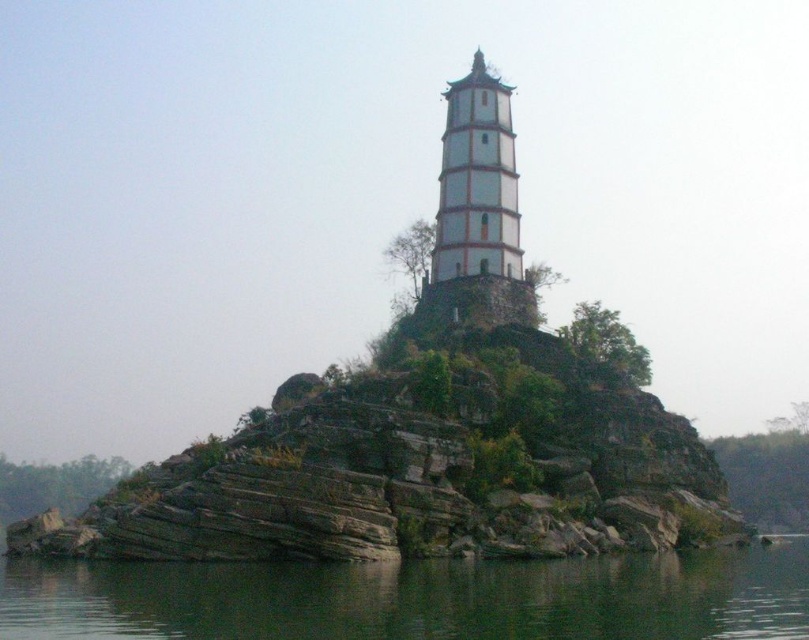
You are a tourist standing on the shore looking at the white stone tower at center. Which direction should you walk to get closer to the greenish water at lower center?

You should walk to your left since the greenish water at lower center is to the left of the white stone tower at center.

You are a boat operator planning to navigate a vessel that is 10 meters wide through the water near the white stone tower at center. Based on the scene, can you determine if the greenish water at lower center has enough width to accommodate your vessel?

The greenish water at lower center might be wider than white stone tower at center. Since the vessel is 10 meters wide, if the water is indeed wider than the tower, it could potentially accommodate the vessel. However, the exact width isn